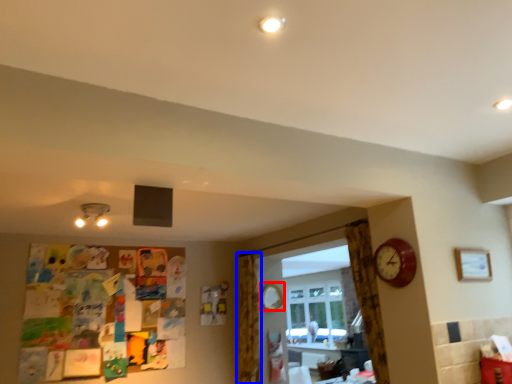
Question: Which of the following is the farthest to the observer, mirror (highlighted by a red box) or curtain (highlighted by a blue box)?

Choices:
 (A) mirror
 (B) curtain

Answer: (A)